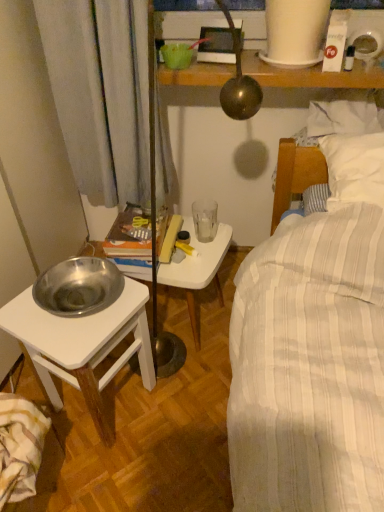
In order to click on vacant region in front of silver metallic bowl at left in this screenshot , I will do `click(120, 477)`.